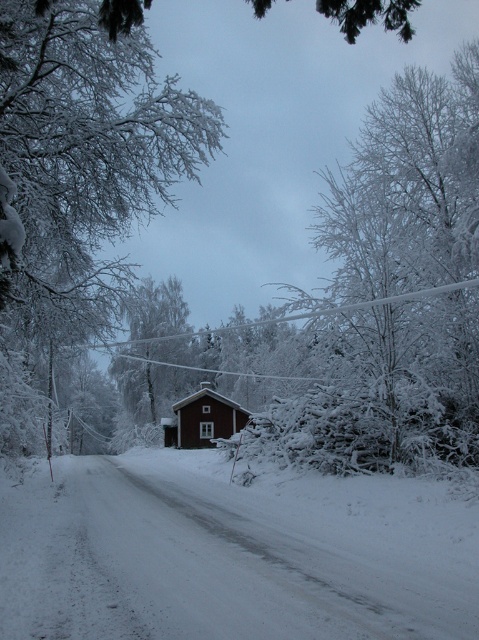
You are a photographer wanting to capture both the white frosty branches at center and the red wooden house at center in a single shot. Given that your camera has a limited field of view, which object should you focus on to ensure both are visible in the frame?

Since the white frosty branches at center is bigger than the red wooden house at center, you should focus on the white frosty branches at center to ensure both are visible in the frame.

You are standing at the end of the snow road looking towards the red wooden house at center. Which direction should you walk to avoid stepping on the white fluffy snow at center?

You should walk to the left of the red wooden house at center to avoid stepping on the white fluffy snow at center, since the snow is located to the right of the house.